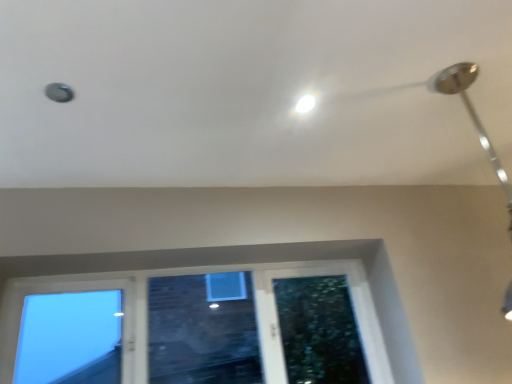
The image size is (512, 384). What do you see at coordinates (192, 274) in the screenshot?
I see `clear glass window at lower left` at bounding box center [192, 274].

Find the location of a particular element. This screenshot has height=384, width=512. silver metallic lamp at upper right is located at coordinates (472, 116).

Measure the distance between point (300, 106) and camera.

1.60 meters.

This screenshot has width=512, height=384. I want to click on clear glass window at lower left, so click(x=192, y=274).

Considering the positions of objects white glossy droplight at upper center and clear glass window at lower left in the image provided, who is more to the right, white glossy droplight at upper center or clear glass window at lower left?

Positioned to the right is white glossy droplight at upper center.

Is white glossy droplight at upper center taller or shorter than clear glass window at lower left?

white glossy droplight at upper center is shorter than clear glass window at lower left.

Is white glossy droplight at upper center situated inside clear glass window at lower left or outside?

white glossy droplight at upper center is outside clear glass window at lower left.

Where is `window on the left of white glossy droplight at upper center`? window on the left of white glossy droplight at upper center is located at coordinates (192, 274).

Is silver metallic lamp at upper right directly adjacent to white glossy droplight at upper center?

silver metallic lamp at upper right and white glossy droplight at upper center are not in contact.

Can you confirm if silver metallic lamp at upper right is wider than white glossy droplight at upper center?

Indeed, silver metallic lamp at upper right has a greater width compared to white glossy droplight at upper center.

Based on the photo, from the image's perspective, is silver metallic lamp at upper right positioned above or below white glossy droplight at upper center?

From the image's perspective, silver metallic lamp at upper right appears below white glossy droplight at upper center.

Who is taller, clear glass window at lower left or silver metallic lamp at upper right?

Standing taller between the two is silver metallic lamp at upper right.

Find the location of `window directly beneath the silver metallic lamp at upper right (from a real-world perspective)`. window directly beneath the silver metallic lamp at upper right (from a real-world perspective) is located at coordinates (192, 274).

Can silver metallic lamp at upper right be found inside clear glass window at lower left?

No, silver metallic lamp at upper right is located outside of clear glass window at lower left.

From a real-world perspective, is silver metallic lamp at upper right on top of clear glass window at lower left?

Yes.

The width and height of the screenshot is (512, 384). In order to click on lamp on the right of the clear glass window at lower left in this screenshot , I will do `click(472, 116)`.

From the image's perspective, between silver metallic lamp at upper right and clear glass window at lower left, who is located below?

clear glass window at lower left is shown below in the image.

Can you tell me how much silver metallic lamp at upper right and clear glass window at lower left differ in facing direction?

There is a 90-degree angle between the facing directions of silver metallic lamp at upper right and clear glass window at lower left.

Is white glossy droplight at upper center not near silver metallic lamp at upper right?

Actually, white glossy droplight at upper center and silver metallic lamp at upper right are a little close together.

From a real-world perspective, does white glossy droplight at upper center stand above silver metallic lamp at upper right?

Yes, from a real-world perspective, white glossy droplight at upper center is over silver metallic lamp at upper right

Which object is more forward, white glossy droplight at upper center or silver metallic lamp at upper right?

silver metallic lamp at upper right is closer to the camera.

Could you tell me if white glossy droplight at upper center is turned towards silver metallic lamp at upper right?

No, white glossy droplight at upper center is not facing towards silver metallic lamp at upper right.

The height and width of the screenshot is (384, 512). Find the location of `window located behind the white glossy droplight at upper center`. window located behind the white glossy droplight at upper center is located at coordinates (192, 274).

Considering the points (98, 289) and (310, 107), which point is in front, point (98, 289) or point (310, 107)?

The point (310, 107) is closer.

Measure the distance from clear glass window at lower left to white glossy droplight at upper center.

clear glass window at lower left is 3.29 feet from white glossy droplight at upper center.

Do you think clear glass window at lower left is within white glossy droplight at upper center, or outside of it?

clear glass window at lower left is outside white glossy droplight at upper center.

Find the location of a particular element. Image resolution: width=512 pixels, height=384 pixels. droplight above the clear glass window at lower left (from the image's perspective) is located at coordinates coord(305,104).

The image size is (512, 384). Find the location of `lamp that appears below the white glossy droplight at upper center (from the image's perspective)`. lamp that appears below the white glossy droplight at upper center (from the image's perspective) is located at coordinates (472, 116).

Considering their positions, is silver metallic lamp at upper right positioned further to clear glass window at lower left than white glossy droplight at upper center?

silver metallic lamp at upper right.

Looking at the image, which one is located closer to clear glass window at lower left, white glossy droplight at upper center or silver metallic lamp at upper right?

white glossy droplight at upper center lies closer to clear glass window at lower left than the other object.

Estimate the real-world distances between objects in this image. Which object is further from silver metallic lamp at upper right, clear glass window at lower left or white glossy droplight at upper center?

Among the two, clear glass window at lower left is located further to silver metallic lamp at upper right.

Based on their spatial positions, is clear glass window at lower left or silver metallic lamp at upper right further from white glossy droplight at upper center?

Based on the image, clear glass window at lower left appears to be further to white glossy droplight at upper center.

Looking at this image, when comparing their distances from silver metallic lamp at upper right, does white glossy droplight at upper center or clear glass window at lower left seem closer?

The object closer to silver metallic lamp at upper right is white glossy droplight at upper center.

Considering their positions, is silver metallic lamp at upper right positioned further to white glossy droplight at upper center than clear glass window at lower left?

clear glass window at lower left is positioned further to the anchor white glossy droplight at upper center.

Locate an element on the screen. Image resolution: width=512 pixels, height=384 pixels. lamp that lies between white glossy droplight at upper center and clear glass window at lower left from top to bottom is located at coordinates (472, 116).